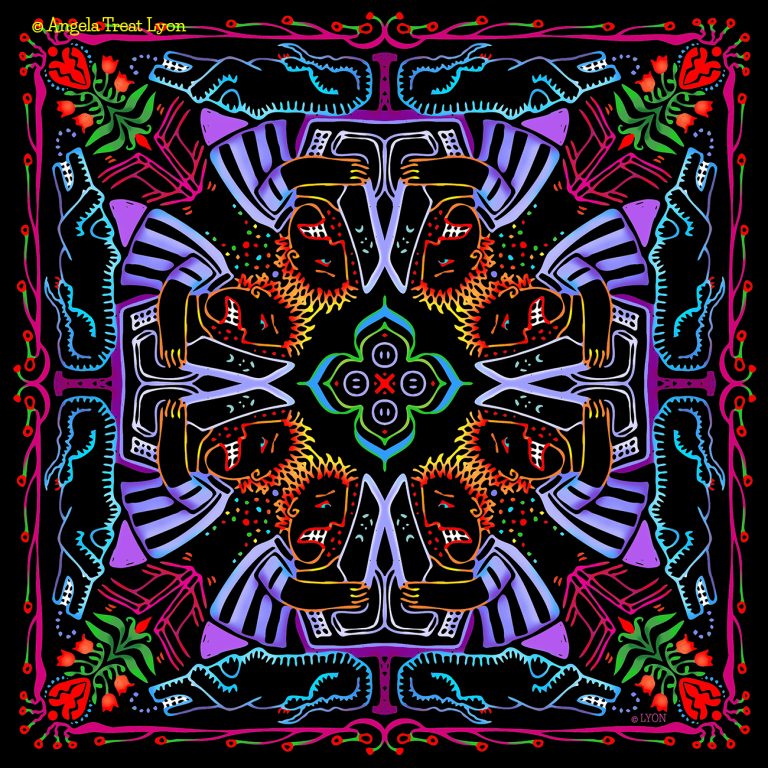
What are the coordinates of `red flowers in corners` in the screenshot? It's located at (694, 693), (68, 697), (70, 65), (689, 71).